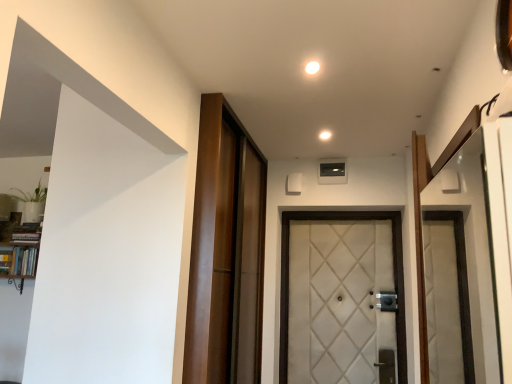
What is the approximate height of white quilted fabric door at center?

white quilted fabric door at center is 3.82 feet tall.

Where is `white glossy light at upper center, the first light positioned from the top`? This screenshot has height=384, width=512. white glossy light at upper center, the first light positioned from the top is located at coordinates (312, 67).

Is wooden barn door at center surrounded by wooden bookshelf at left?

No, wooden bookshelf at left does not contain wooden barn door at center.

Does wooden bookshelf at left turn towards wooden barn door at center?

No.

In terms of height, does wooden bookshelf at left look taller or shorter compared to wooden barn door at center?

Clearly, wooden bookshelf at left is shorter compared to wooden barn door at center.

Looking at this image, is there a large distance between wooden bookshelf at left and wooden barn door at center?

Yes, wooden bookshelf at left is far from wooden barn door at center.

Looking at their sizes, would you say white quilted fabric door at center is wider or thinner than white glossy light at upper center, which is the 2th light from right to left?

white quilted fabric door at center is wider than white glossy light at upper center, which is the 2th light from right to left.

From the image's perspective, would you say white quilted fabric door at center is positioned over white glossy light at upper center, which is the 2th light from right to left?

No, from the image's perspective, white quilted fabric door at center is not on top of white glossy light at upper center, which is the 2th light from right to left.

Would you consider white quilted fabric door at center to be distant from white glossy light at upper center, placed as the 2th light when sorted from back to front?

Yes, white quilted fabric door at center and white glossy light at upper center, placed as the 2th light when sorted from back to front, are located far from each other.

Which is correct: white quilted fabric door at center is inside white glossy light at upper center, the 2th light ordered from the bottom, or outside of it?

white quilted fabric door at center is not inside white glossy light at upper center, the 2th light ordered from the bottom, it's outside.

Are wooden barn door at center and white glossy light at upper center, the 2th light ordered from the bottom, far apart?

wooden barn door at center is positioned a significant distance from white glossy light at upper center, the 2th light ordered from the bottom.

Measure the distance from wooden barn door at center to white glossy light at upper center, arranged as the first light when viewed from the front.

wooden barn door at center is 1.11 meters away from white glossy light at upper center, arranged as the first light when viewed from the front.

Based on their sizes in the image, would you say wooden barn door at center is bigger or smaller than white glossy light at upper center, arranged as the first light when viewed from the front?

wooden barn door at center is bigger than white glossy light at upper center, arranged as the first light when viewed from the front.

Between wooden barn door at center and white glossy light at upper center, the first light positioned from the top, which one has less height?

Standing shorter between the two is white glossy light at upper center, the first light positioned from the top.

Considering the positions of objects white glossy light at upper center, arranged as the first light when viewed from the front, and white quilted fabric door at center in the image provided, who is behind, white glossy light at upper center, arranged as the first light when viewed from the front, or white quilted fabric door at center?

white quilted fabric door at center.

Does white glossy light at upper center, the 2th light ordered from the bottom, touch white quilted fabric door at center?

white glossy light at upper center, the 2th light ordered from the bottom, and white quilted fabric door at center are clearly separated.

Which of these two, white glossy light at upper center, which is the 2th light from right to left, or white quilted fabric door at center, is thinner?

With smaller width is white glossy light at upper center, which is the 2th light from right to left.

Is wooden barn door at center touching white glossy light at center, acting as the 2th light starting from the front?

wooden barn door at center and white glossy light at center, acting as the 2th light starting from the front, are not in contact.

From the image's perspective, is wooden barn door at center on white glossy light at center, which ranks as the second light in left-to-right order?

No.

Considering the sizes of objects wooden barn door at center and white glossy light at center, the first light when ordered from right to left, in the image provided, who is thinner, wooden barn door at center or white glossy light at center, the first light when ordered from right to left,?

white glossy light at center, the first light when ordered from right to left.

Looking at this image, from a real-world perspective, who is located higher, white quilted fabric door at center or wooden bookshelf at left?

wooden bookshelf at left is physically above.

Is white quilted fabric door at center positioned with its back to wooden bookshelf at left?

No, white quilted fabric door at center is not facing away from wooden bookshelf at left.

Which is more to the right, white quilted fabric door at center or wooden bookshelf at left?

white quilted fabric door at center is more to the right.

In the scene shown: How distant is white quilted fabric door at center from wooden bookshelf at left?

white quilted fabric door at center and wooden bookshelf at left are 7.05 feet apart from each other.

Between point (326, 130) and point (318, 69), which one is positioned behind?

Positioned behind is point (326, 130).

Relative to white glossy light at upper center, arranged as the first light when viewed from the front, is white glossy light at center, placed as the 1th light when sorted from back to front, in front or behind?

In the image, white glossy light at center, placed as the 1th light when sorted from back to front, appears behind white glossy light at upper center, arranged as the first light when viewed from the front.

Consider the image. Is white glossy light at center, acting as the 2th light starting from the front, far away from white glossy light at upper center, which is the 1th light in left-to-right order?

No, white glossy light at center, acting as the 2th light starting from the front, is not far away from white glossy light at upper center, which is the 1th light in left-to-right order.

Is white glossy light at center, marked as the 2th light in a top-to-bottom arrangement, facing away from white glossy light at upper center, the first light positioned from the top?

No, white glossy light at upper center, the first light positioned from the top, is not at the back of white glossy light at center, marked as the 2th light in a top-to-bottom arrangement.

You are a GUI agent. You are given a task and a screenshot of the screen. Output one action in this format:
    pyautogui.click(x=<x>, y=<y>)
    Task: Click on the barn door to the right of wooden bookshelf at left
    
    Given the screenshot: What is the action you would take?
    pyautogui.click(x=226, y=252)

Where is `door below the white glossy light at upper center, the 2th light ordered from the bottom (from the image's perspective)`? door below the white glossy light at upper center, the 2th light ordered from the bottom (from the image's perspective) is located at coordinates (393, 267).

When comparing their distances from wooden bookshelf at left, does wooden barn door at center or white glossy light at center, which ranks as the second light in left-to-right order, seem further?

white glossy light at center, which ranks as the second light in left-to-right order, is positioned further to the anchor wooden bookshelf at left.

Looking at the image, which one is located further to wooden barn door at center, white glossy light at upper center, which is the 2th light from right to left, or white quilted fabric door at center?

white glossy light at upper center, which is the 2th light from right to left, is further to wooden barn door at center.

When comparing their distances from white glossy light at center, acting as the 2th light starting from the front, does wooden barn door at center or white glossy light at upper center, which is the 2th light from right to left, seem closer?

Based on the image, white glossy light at upper center, which is the 2th light from right to left, appears to be nearer to white glossy light at center, acting as the 2th light starting from the front.

Looking at the image, which one is located closer to white glossy light at upper center, the first light positioned from the top, wooden barn door at center or white glossy light at center, placed as the 1th light when sorted from back to front?

white glossy light at center, placed as the 1th light when sorted from back to front.

Consider the image. From the image, which object appears to be farther from white glossy light at upper center, which is the 2th light from right to left, wooden barn door at center or white quilted fabric door at center?

Among the two, white quilted fabric door at center is located further to white glossy light at upper center, which is the 2th light from right to left.

Based on their spatial positions, is white glossy light at center, placed as the 1th light when sorted from back to front, or white quilted fabric door at center closer to wooden barn door at center?

Based on the image, white quilted fabric door at center appears to be nearer to wooden barn door at center.

Considering their positions, is wooden bookshelf at left positioned further to white glossy light at upper center, which is the 2th light from right to left, than white glossy light at center, positioned as the 1th light in bottom-to-top order?

wooden bookshelf at left.

When comparing their distances from white quilted fabric door at center, does wooden barn door at center or white glossy light at center, positioned as the 1th light in bottom-to-top order, seem closer?

wooden barn door at center.

I want to click on barn door between wooden bookshelf at left and white glossy light at center, positioned as the 1th light in bottom-to-top order, in the horizontal direction, so click(226, 252).

The width and height of the screenshot is (512, 384). Identify the location of light between white glossy light at upper center, which is the 1th light in left-to-right order, and white quilted fabric door at center from top to bottom. (325, 135).

Where is `barn door between wooden bookshelf at left and white quilted fabric door at center in the horizontal direction`? This screenshot has width=512, height=384. barn door between wooden bookshelf at left and white quilted fabric door at center in the horizontal direction is located at coordinates (226, 252).

At what (x,y) coordinates should I click in order to perform the action: click on barn door between white glossy light at upper center, the 2th light ordered from the bottom, and white quilted fabric door at center from top to bottom. Please return your answer as a coordinate pair (x, y). The height and width of the screenshot is (384, 512). Looking at the image, I should click on (226, 252).